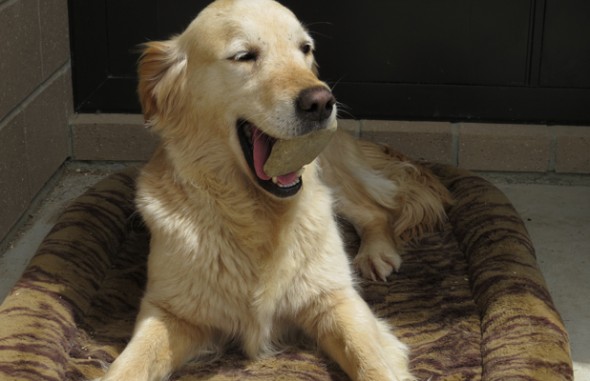
At what (x,y) coordinates should I click in order to perform the action: click on moulding. Please return your answer as a coordinate pair (x, y). This screenshot has height=381, width=590. Looking at the image, I should click on (88, 149).